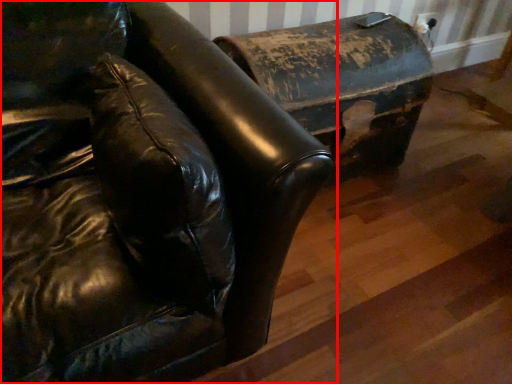
Question: From the image's perspective, where is furniture (annotated by the red box) located in relation to furniture in the image?

Choices:
 (A) below
 (B) above

Answer: (A)